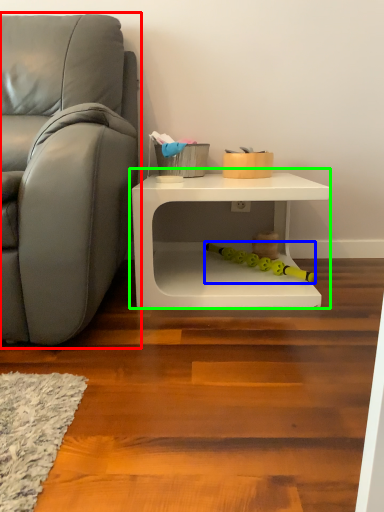
Question: Considering the real-world distances, which object is closest to studio couch (highlighted by a red box)? toy (highlighted by a blue box) or table (highlighted by a green box).

Choices:
 (A) toy
 (B) table

Answer: (B)